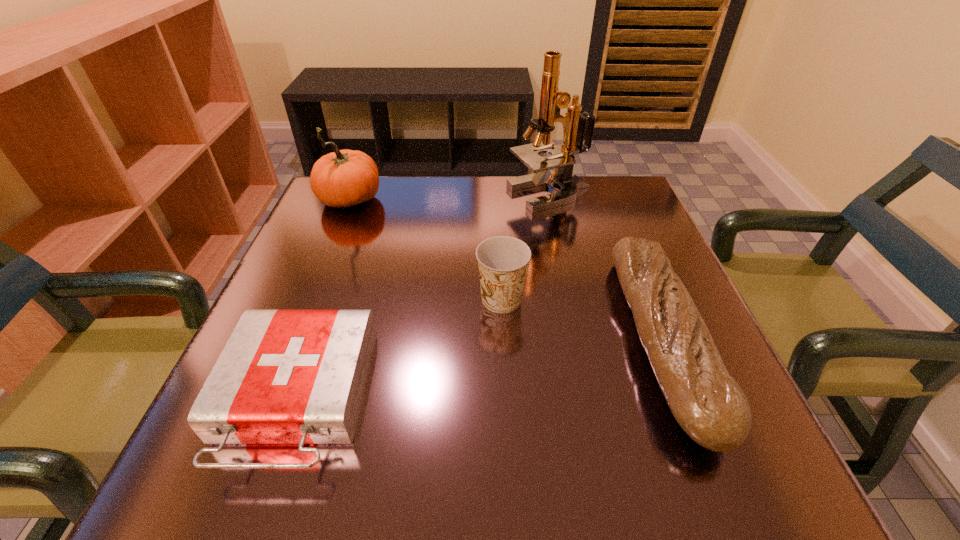
Identify the location of vacant space located on the back of the baguet. (598, 177).

Where is `microscope that is positioned at the far edge`? microscope that is positioned at the far edge is located at coordinates (562, 158).

You are a GUI agent. You are given a task and a screenshot of the screen. Output one action in this format:
    pyautogui.click(x=<x>, y=<y>)
    Task: Click on the pumpkin located in the far edge section of the desktop
    Image resolution: width=960 pixels, height=540 pixels.
    Given the screenshot: What is the action you would take?
    pyautogui.click(x=343, y=178)

Locate an element on the screen. baguet at the near edge is located at coordinates (709, 405).

Locate an element on the screen. the first-aid kit that is at the near edge is located at coordinates (284, 376).

This screenshot has width=960, height=540. What are the coordinates of `pumpkin that is at the left edge` in the screenshot? It's located at pos(343,178).

At what (x,y) coordinates should I click in order to perform the action: click on the first-aid kit that is at the left edge. Please return your answer as a coordinate pair (x, y). This screenshot has width=960, height=540. Looking at the image, I should click on (284, 376).

Identify the location of microscope at the right edge. The image size is (960, 540). pos(562,158).

Image resolution: width=960 pixels, height=540 pixels. Find the location of `baguet present at the right edge`. baguet present at the right edge is located at coordinates (709, 405).

Identify the location of object that is at the far left corner. The width and height of the screenshot is (960, 540). (343, 178).